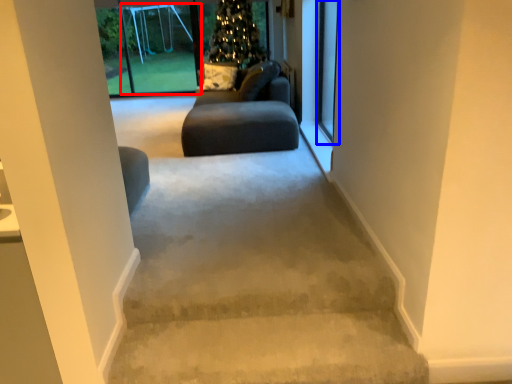
Question: Which of the following is the closest to the observer, screen door (highlighted by a red box) or screen door (highlighted by a blue box)?

Choices:
 (A) screen door
 (B) screen door

Answer: (B)